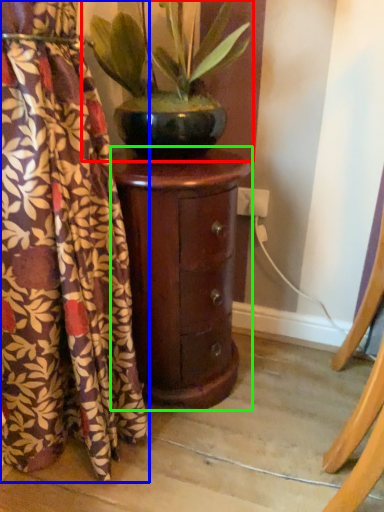
Question: Based on their relative distances, which object is farther from houseplant (highlighted by a red box)? Choose from curtain (highlighted by a blue box) and furniture (highlighted by a green box).

Choices:
 (A) curtain
 (B) furniture

Answer: (A)